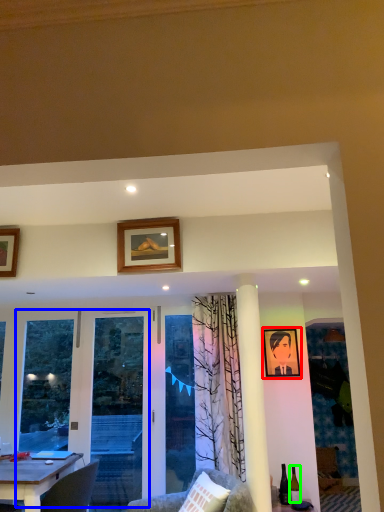
Question: Based on their relative distances, which object is nearer to picture frame (highlighted by a red box)? Choose from screen door (highlighted by a blue box) and wine bottle (highlighted by a green box).

Choices:
 (A) screen door
 (B) wine bottle

Answer: (B)